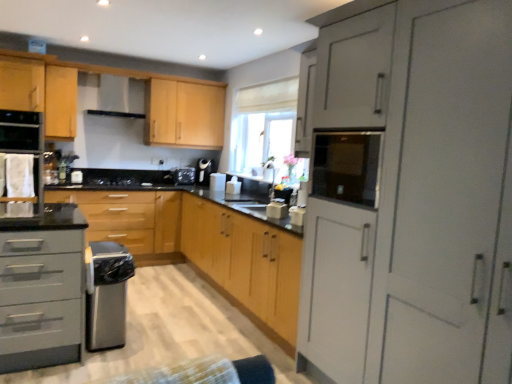
Describe the element at coordinates (131, 221) in the screenshot. I see `wooden cabinet at center, the 4th cabinetry from the front` at that location.

Locate an element on the screen. The width and height of the screenshot is (512, 384). satin black stove at center, marked as the second appliance in a left-to-right arrangement is located at coordinates (183, 175).

The width and height of the screenshot is (512, 384). Describe the element at coordinates (114, 98) in the screenshot. I see `black matte exhaust hood at upper center` at that location.

The width and height of the screenshot is (512, 384). What are the coordinates of `black matte exhaust hood at upper center` in the screenshot? It's located at (x=114, y=98).

The height and width of the screenshot is (384, 512). Find the location of `satin black coffee maker at center, which is the 3th appliance in left-to-right order`. satin black coffee maker at center, which is the 3th appliance in left-to-right order is located at coordinates (204, 171).

At what (x,y) coordinates should I click in order to perform the action: click on white glossy toaster at center, the third appliance positioned from the front. Please return your answer as a coordinate pair (x, y). The height and width of the screenshot is (384, 512). Looking at the image, I should click on pos(233,186).

Image resolution: width=512 pixels, height=384 pixels. I want to click on white fabric oven at left, so click(x=21, y=155).

Measure the distance between point (39, 138) and camera.

Point (39, 138) and camera are 13.74 feet apart.

Identify the location of wooden cabinet at center, the 2th cabinetry from the back. (131, 221).

Considering the sizes of objects satin silver dishwasher at lower left and matte black toaster at center, positioned as the 1th appliance in front-to-back order, in the image provided, who is bigger, satin silver dishwasher at lower left or matte black toaster at center, positioned as the 1th appliance in front-to-back order,?

satin silver dishwasher at lower left is bigger.

From a real-world perspective, who is located lower, satin silver dishwasher at lower left or matte black toaster at center, which is counted as the 6th appliance, starting from the back?

From a 3D spatial view, satin silver dishwasher at lower left is below.

Is satin silver dishwasher at lower left spatially inside matte black toaster at center, positioned as the 1th appliance in front-to-back order, or outside of it?

satin silver dishwasher at lower left lies outside matte black toaster at center, positioned as the 1th appliance in front-to-back order.

What's the angular difference between white glossy paper towel dispenser at center, arranged as the third appliance when viewed from the back, and matte gray cabinet at right, which is the fifth cabinetry from back to front,'s facing directions?

0.804 degrees separate the facing orientations of white glossy paper towel dispenser at center, arranged as the third appliance when viewed from the back, and matte gray cabinet at right, which is the fifth cabinetry from back to front.

Who is more distant, white glossy paper towel dispenser at center, the fourth appliance viewed from the front, or matte gray cabinet at right, which is the fifth cabinetry from back to front?

white glossy paper towel dispenser at center, the fourth appliance viewed from the front, is behind.

Considering the sizes of objects white glossy paper towel dispenser at center, arranged as the third appliance when viewed from the back, and matte gray cabinet at right, which is the fifth cabinetry from back to front, in the image provided, who is wider, white glossy paper towel dispenser at center, arranged as the third appliance when viewed from the back, or matte gray cabinet at right, which is the fifth cabinetry from back to front,?

matte gray cabinet at right, which is the fifth cabinetry from back to front.

Is white glossy paper towel dispenser at center, the fourth appliance viewed from the front, not inside matte gray cabinet at right, which is the fifth cabinetry from back to front?

Absolutely, white glossy paper towel dispenser at center, the fourth appliance viewed from the front, is external to matte gray cabinet at right, which is the fifth cabinetry from back to front.

Is white glossy toaster at center, marked as the 5th appliance in a left-to-right arrangement, turned away from white glossy paper towel dispenser at center, arranged as the third appliance when viewed from the back?

No.

Considering the relative sizes of white glossy toaster at center, which ranks as the second appliance in right-to-left order, and white glossy paper towel dispenser at center, positioned as the fourth appliance in left-to-right order, in the image provided, is white glossy toaster at center, which ranks as the second appliance in right-to-left order, shorter than white glossy paper towel dispenser at center, positioned as the fourth appliance in left-to-right order,?

Indeed, white glossy toaster at center, which ranks as the second appliance in right-to-left order, has a lesser height compared to white glossy paper towel dispenser at center, positioned as the fourth appliance in left-to-right order.

From the picture: From the image's perspective, which is above, white glossy toaster at center, which ranks as the second appliance in right-to-left order, or white glossy paper towel dispenser at center, arranged as the third appliance when viewed from the back?

From the image's view, white glossy paper towel dispenser at center, arranged as the third appliance when viewed from the back, is above.

Does white glossy toaster at center, which ranks as the second appliance in right-to-left order, appear on the right side of white glossy paper towel dispenser at center, positioned as the fourth appliance in left-to-right order?

Indeed, white glossy toaster at center, which ranks as the second appliance in right-to-left order, is positioned on the right side of white glossy paper towel dispenser at center, positioned as the fourth appliance in left-to-right order.

Considering the positions of point (4, 284) and point (62, 191), is point (4, 284) closer or farther from the camera than point (62, 191)?

Clearly, point (4, 284) is closer to the camera than point (62, 191).

Based on the photo, from the image's perspective, is matte gray drawer at left, the third cabinetry in the back-to-front sequence, above or below wooden cabinet at center, the 4th cabinetry from the front?

matte gray drawer at left, the third cabinetry in the back-to-front sequence, is situated lower than wooden cabinet at center, the 4th cabinetry from the front, in the image.

Where is `the 2nd cabinetry located above the wooden cabinet at center, the 2th cabinetry from the back (from a real-world perspective)`? Image resolution: width=512 pixels, height=384 pixels. the 2nd cabinetry located above the wooden cabinet at center, the 2th cabinetry from the back (from a real-world perspective) is located at coordinates (40, 285).

How much distance is there between matte black toaster at center, arranged as the sixth appliance when viewed from the left, and black matte gas stove at center?

They are 1.91 meters apart.

Which object is thinner, matte black toaster at center, placed as the 1th appliance when sorted from right to left, or black matte gas stove at center?

matte black toaster at center, placed as the 1th appliance when sorted from right to left.

Which is closer to the camera, [275,197] or [133,188]?

Point [275,197]

Is matte black toaster at center, which is counted as the 6th appliance, starting from the back, oriented towards black matte gas stove at center?

No.

From the image's perspective, between matte gray cabinet at right, marked as the 1th cabinetry in a front-to-back arrangement, and white glossy paper towel dispenser at center, arranged as the third appliance when viewed from the back, who is located below?

matte gray cabinet at right, marked as the 1th cabinetry in a front-to-back arrangement.

Considering the relative positions of matte gray cabinet at right, marked as the 1th cabinetry in a front-to-back arrangement, and white glossy paper towel dispenser at center, positioned as the fourth appliance in left-to-right order, in the image provided, is matte gray cabinet at right, marked as the 1th cabinetry in a front-to-back arrangement, to the left or to the right of white glossy paper towel dispenser at center, positioned as the fourth appliance in left-to-right order,?

Based on their positions, matte gray cabinet at right, marked as the 1th cabinetry in a front-to-back arrangement, is located to the right of white glossy paper towel dispenser at center, positioned as the fourth appliance in left-to-right order.

In the scene shown: Is matte gray cabinet at right, marked as the 1th cabinetry in a front-to-back arrangement, far from white glossy paper towel dispenser at center, arranged as the third appliance when viewed from the back?

Absolutely, matte gray cabinet at right, marked as the 1th cabinetry in a front-to-back arrangement, is distant from white glossy paper towel dispenser at center, arranged as the third appliance when viewed from the back.

Considering the sizes of objects matte gray cabinet at right, which is the fifth cabinetry from back to front, and white glossy paper towel dispenser at center, positioned as the fourth appliance in left-to-right order, in the image provided, who is taller, matte gray cabinet at right, which is the fifth cabinetry from back to front, or white glossy paper towel dispenser at center, positioned as the fourth appliance in left-to-right order,?

Standing taller between the two is matte gray cabinet at right, which is the fifth cabinetry from back to front.

Relative to matte gray cabinet at right, marked as the 1th cabinetry in a front-to-back arrangement, is satin silver dishwasher at lower left in front or behind?

Visually, satin silver dishwasher at lower left is located behind matte gray cabinet at right, marked as the 1th cabinetry in a front-to-back arrangement.

From a real-world perspective, who is located higher, satin silver dishwasher at lower left or matte gray cabinet at right, marked as the 1th cabinetry in a front-to-back arrangement?

From a 3D spatial view, matte gray cabinet at right, marked as the 1th cabinetry in a front-to-back arrangement, is above.

From the image's perspective, is satin silver dishwasher at lower left on matte gray cabinet at right, which is the fifth cabinetry from back to front?

No, from the image's perspective, satin silver dishwasher at lower left is not on top of matte gray cabinet at right, which is the fifth cabinetry from back to front.

You are a GUI agent. You are given a task and a screenshot of the screen. Output one action in this format:
    pyautogui.click(x=<x>, y=<y>)
    Task: Click on the dish washer behind the matte gray cabinet at right, marked as the 1th cabinetry in a front-to-back arrangement
    The image size is (512, 384).
    Given the screenshot: What is the action you would take?
    pyautogui.click(x=108, y=296)

At what (x,y) coordinates should I click in order to perform the action: click on dish washer that appears on the left of matte black toaster at center, placed as the 1th appliance when sorted from right to left. Please return your answer as a coordinate pair (x, y). The height and width of the screenshot is (384, 512). Looking at the image, I should click on (108, 296).

Locate an element on the screen. the 1st cabinetry located above the white glossy paper towel dispenser at center, positioned as the fourth appliance in left-to-right order (from a real-world perspective) is located at coordinates (410, 197).

When comparing their distances from white fabric oven at left, does black glass oven at left, marked as the 2th appliance in a front-to-back arrangement, or black matte exhaust hood at upper center seem closer?

The object closer to white fabric oven at left is black glass oven at left, marked as the 2th appliance in a front-to-back arrangement.

From the image, which object appears to be farther from wooden cabinet at center, the 2th cabinetry from the back, satin black coffee maker at center, the 4th appliance positioned from the right, or matte gray cabinet at left, the 2th cabinetry positioned from the front?

Among the two, satin black coffee maker at center, the 4th appliance positioned from the right, is located further to wooden cabinet at center, the 2th cabinetry from the back.

Estimate the real-world distances between objects in this image. Which object is closer to light wood cabinet at upper left, the 5th cabinetry viewed from the front, black matte gas stove at center or white glossy toaster at center?

Based on the image, black matte gas stove at center appears to be nearer to light wood cabinet at upper left, the 5th cabinetry viewed from the front.

In the scene shown: Looking at the image, which one is located closer to white glossy toaster at center, which ranks as the second appliance in right-to-left order, black glass microwave at upper right or black glass oven at left, which is the fifth appliance in back-to-front order?

The object closer to white glossy toaster at center, which ranks as the second appliance in right-to-left order, is black glass oven at left, which is the fifth appliance in back-to-front order.

Which object lies nearer to the anchor point matte gray cabinet at left, the 4th cabinetry positioned from the back, white glossy toaster at center, the third appliance positioned from the front, or satin black stove at center, which is the 5th appliance in front-to-back order?

Among the two, white glossy toaster at center, the third appliance positioned from the front, is located nearer to matte gray cabinet at left, the 4th cabinetry positioned from the back.

Considering their positions, is matte gray cabinet at right, which is the fifth cabinetry from back to front, positioned further to light wood cabinet at upper left, the 1th cabinetry when ordered from back to front, than wooden cabinet at center, the 2th cabinetry from the back?

matte gray cabinet at right, which is the fifth cabinetry from back to front, lies further to light wood cabinet at upper left, the 1th cabinetry when ordered from back to front, than the other object.

When comparing their distances from black glass oven at left, positioned as the sixth appliance in right-to-left order, does white glossy paper towel dispenser at center, arranged as the third appliance when viewed from the back, or satin silver dishwasher at lower left seem further?

white glossy paper towel dispenser at center, arranged as the third appliance when viewed from the back.

Which object lies nearer to the anchor point matte black toaster at center, placed as the 1th appliance when sorted from right to left, matte gray cabinet at left, the 4th cabinetry positioned from the back, or black matte exhaust hood at upper center?

The object closer to matte black toaster at center, placed as the 1th appliance when sorted from right to left, is matte gray cabinet at left, the 4th cabinetry positioned from the back.

At what (x,y) coordinates should I click in order to perform the action: click on exhaust hood between matte gray cabinet at right, marked as the 1th cabinetry in a front-to-back arrangement, and white glossy paper towel dispenser at center, acting as the 3th appliance starting from the right, along the z-axis. Please return your answer as a coordinate pair (x, y). Image resolution: width=512 pixels, height=384 pixels. Looking at the image, I should click on (114, 98).

Where is `kitchen appliance situated between matte gray cabinet at left, the 2th cabinetry positioned from the front, and black glass microwave at upper right from left to right`? The height and width of the screenshot is (384, 512). kitchen appliance situated between matte gray cabinet at left, the 2th cabinetry positioned from the front, and black glass microwave at upper right from left to right is located at coordinates (277, 209).

The width and height of the screenshot is (512, 384). Find the location of `gas stove between white fabric oven at left and white glossy toaster at center in the horizontal direction`. gas stove between white fabric oven at left and white glossy toaster at center in the horizontal direction is located at coordinates (119, 179).

In order to click on home appliance between matte gray drawer at left, the 3th cabinetry in the front-to-back sequence, and satin black coffee maker at center, which is the 6th appliance in front-to-back order, along the z-axis in this screenshot , I will do `click(21, 155)`.